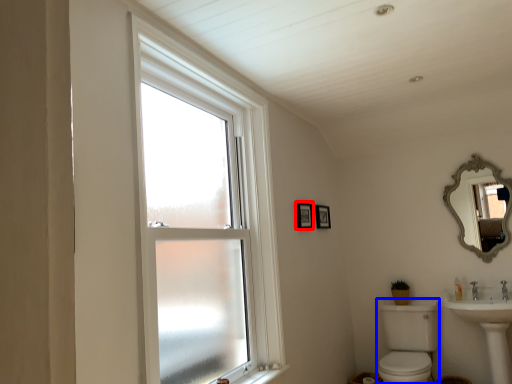
Question: Which object appears closest to the camera in this image, picture frame (highlighted by a red box) or sink (highlighted by a blue box)?

Choices:
 (A) picture frame
 (B) sink

Answer: (B)